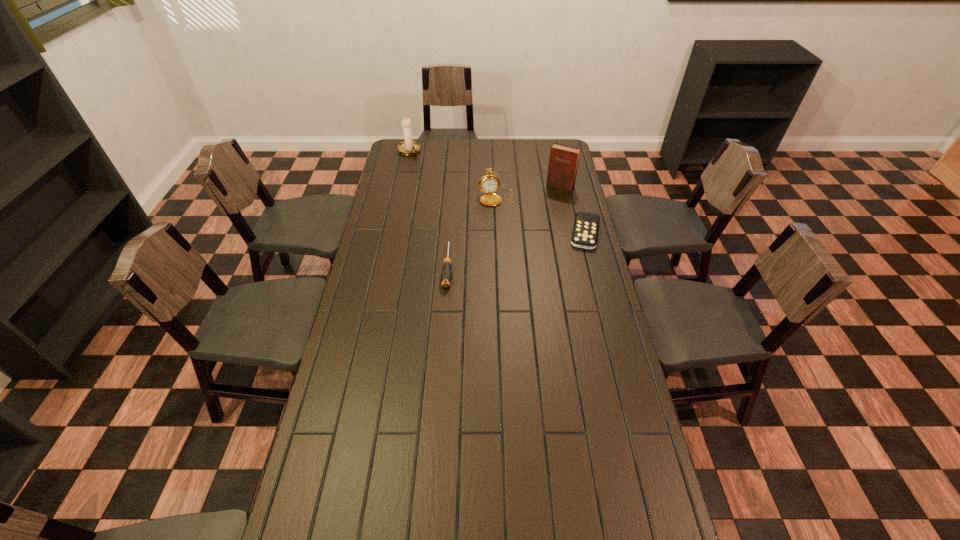
You are a GUI agent. You are given a task and a screenshot of the screen. Output one action in this format:
    pyautogui.click(x=<x>, y=<y>)
    Task: Click on the vacant position located on the front cover of the diary
    
    Given the screenshot: What is the action you would take?
    pyautogui.click(x=541, y=214)

The height and width of the screenshot is (540, 960). Find the location of `free space located 0.080m on the front cover of the diary`. free space located 0.080m on the front cover of the diary is located at coordinates (549, 200).

Locate an element on the screen. free space located on the front cover of the diary is located at coordinates (538, 219).

You are a GUI agent. You are given a task and a screenshot of the screen. Output one action in this format:
    pyautogui.click(x=<x>, y=<y>)
    Task: Click on the free space located 0.220m on the face of the third tallest object
    The image size is (960, 540).
    Given the screenshot: What is the action you would take?
    pyautogui.click(x=509, y=240)

Find the location of a particular element. The width and height of the screenshot is (960, 540). blank space located on the face of the third tallest object is located at coordinates (504, 222).

The height and width of the screenshot is (540, 960). I want to click on vacant position located on the face of the third tallest object, so click(515, 263).

Where is `free space located on the handle side of the farthest object`? Image resolution: width=960 pixels, height=540 pixels. free space located on the handle side of the farthest object is located at coordinates (428, 168).

At what (x,y) coordinates should I click in order to perform the action: click on blank area located 0.390m on the handle side of the farthest object. Please return your answer as a coordinate pair (x, y). Image resolution: width=960 pixels, height=540 pixels. Looking at the image, I should click on (456, 192).

I want to click on vacant space located on the handle side of the farthest object, so click(x=424, y=165).

Find the location of a particular element. This screenshot has width=960, height=540. object present at the far edge is located at coordinates point(409,147).